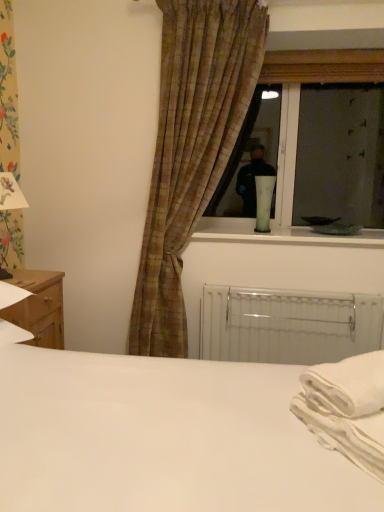
Question: Considering their positions, is plaid fabric curtain at center located in front of or behind green glass vase at window, which is counted as the second table lamp, starting from the left?

Choices:
 (A) behind
 (B) front

Answer: (B)

Question: Visually, is plaid fabric curtain at center positioned to the left or to the right of green glass vase at window, which is the 2th table lamp in front-to-back order?

Choices:
 (A) left
 (B) right

Answer: (A)

Question: Estimate the real-world distances between objects in this image. Which object is farther from the white metallic radiator at lower center?

Choices:
 (A) wooden nightstand at lower left
 (B) white cotton cloth at lower right
 (C) white paper lampshade at left, the first table lamp viewed from the left
 (D) plaid fabric curtain at center
 (E) green glass vase at window, marked as the 1th table lamp in a back-to-front arrangement

Answer: (C)

Question: Estimate the real-world distances between objects in this image. Which object is closer to the plaid fabric curtain at center?

Choices:
 (A) white metallic radiator at lower center
 (B) white matte bed at center
 (C) green glass vase at window, the 1th table lamp from the right
 (D) wooden nightstand at lower left
 (E) white cotton cloth at lower right

Answer: (C)